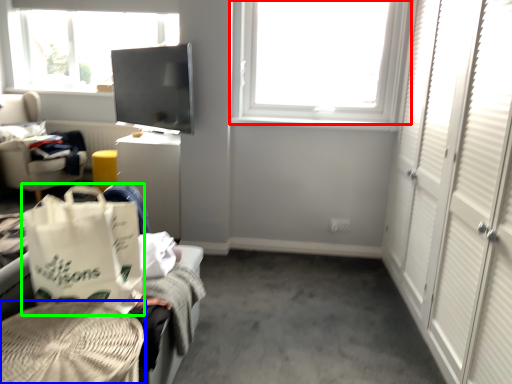
Question: Which object is the farthest from window (highlighted by a red box)? Choose among these: furniture (highlighted by a blue box) or shopping bag (highlighted by a green box).

Choices:
 (A) furniture
 (B) shopping bag

Answer: (A)